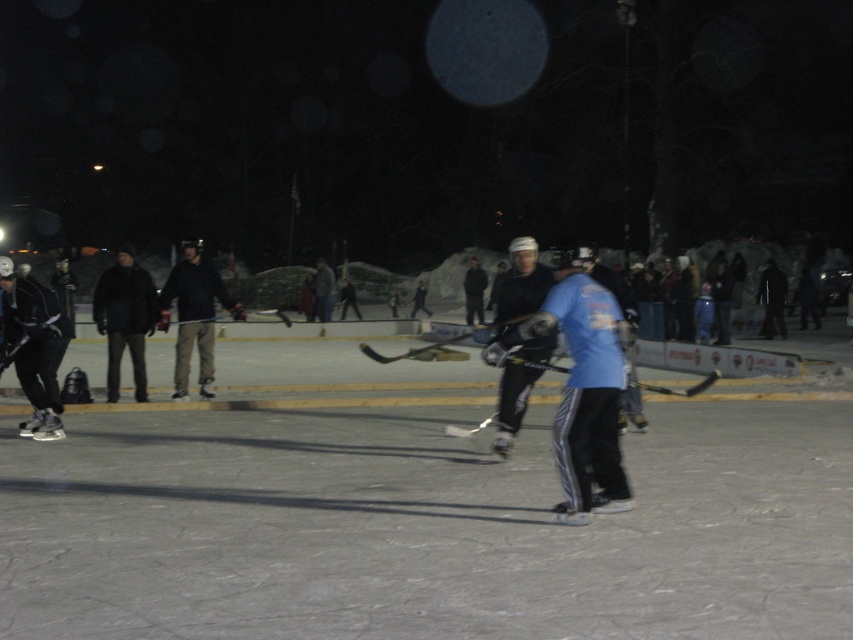
You are an ice hockey player preparing to slide a puck across the ice. Given the sizes of the smooth ice rink at center and the blue fabric shirt at center, which object will the puck travel across before reaching the other?

The puck will travel across the smooth ice rink at center first because it has a larger size compared to the blue fabric shirt at center, making it the primary surface for movement in this context.